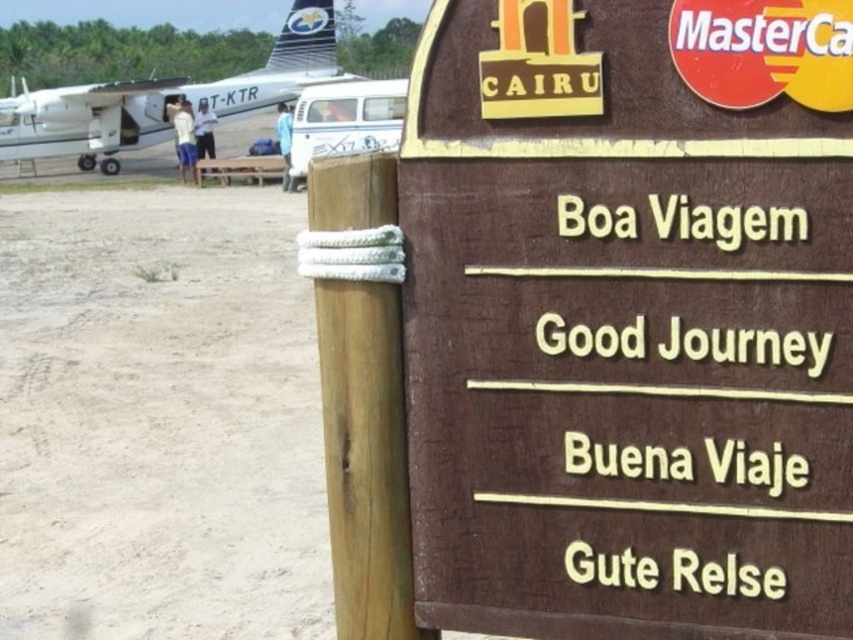
Does light brown sand at lower left appear on the left side of white glossy airplane at upper left?

In fact, light brown sand at lower left is to the right of white glossy airplane at upper left.

What do you see at coordinates (158, 419) in the screenshot? I see `light brown sand at lower left` at bounding box center [158, 419].

Who is more distant from viewer, (294, 474) or (126, 109)?

The point (126, 109) is more distant.

Image resolution: width=853 pixels, height=640 pixels. In order to click on light brown sand at lower left in this screenshot , I will do `click(158, 419)`.

Measure the distance from brown wooden sign at center to white glossy airplane at upper left.

A distance of 15.65 meters exists between brown wooden sign at center and white glossy airplane at upper left.

Can you confirm if brown wooden sign at center is shorter than white glossy airplane at upper left?

Indeed, brown wooden sign at center has a lesser height compared to white glossy airplane at upper left.

What do you see at coordinates (630, 317) in the screenshot? The width and height of the screenshot is (853, 640). I see `brown wooden sign at center` at bounding box center [630, 317].

Identify the location of brown wooden sign at center. (630, 317).

Which is above, brown wooden sign at center or light brown sand at lower left?

light brown sand at lower left

At what (x,y) coordinates should I click in order to perform the action: click on brown wooden sign at center. Please return your answer as a coordinate pair (x, y). Image resolution: width=853 pixels, height=640 pixels. Looking at the image, I should click on (630, 317).

Where is `brown wooden sign at center`? This screenshot has width=853, height=640. brown wooden sign at center is located at coordinates (630, 317).